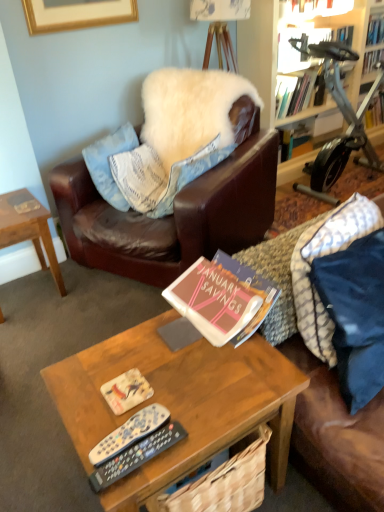
I want to click on blank space situated above woodenwoodencoffee table at center, which appears as the first coffee table when viewed from the right (from a real-world perspective), so click(178, 367).